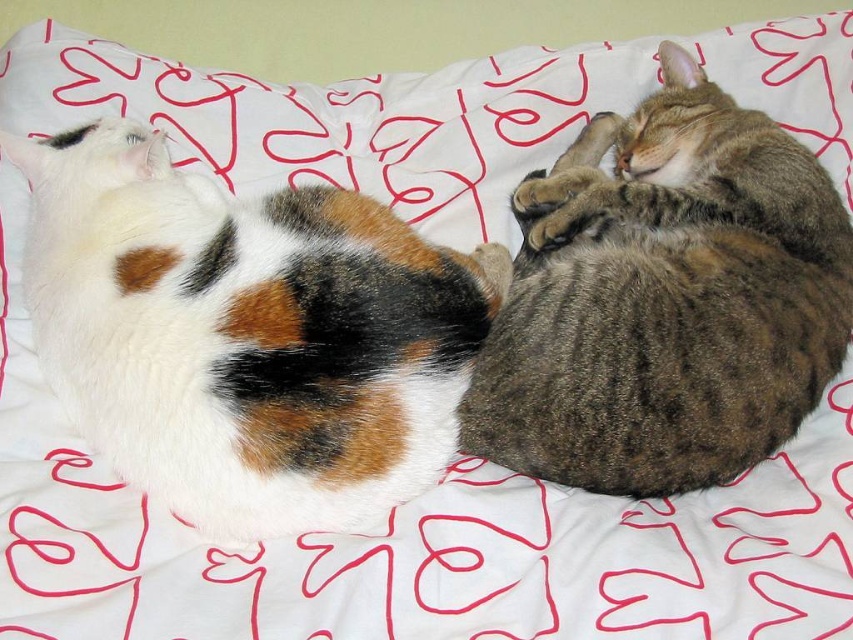
Question: Observing the image, what is the correct spatial positioning of white fluffy cat at left in reference to tabby fur cat at center?

Choices:
 (A) right
 (B) left

Answer: (B)

Question: Does white fluffy cat at left have a larger size compared to tabby fur cat at center?

Choices:
 (A) no
 (B) yes

Answer: (B)

Question: Is white fluffy cat at left further to the viewer compared to tabby fur cat at center?

Choices:
 (A) no
 (B) yes

Answer: (A)